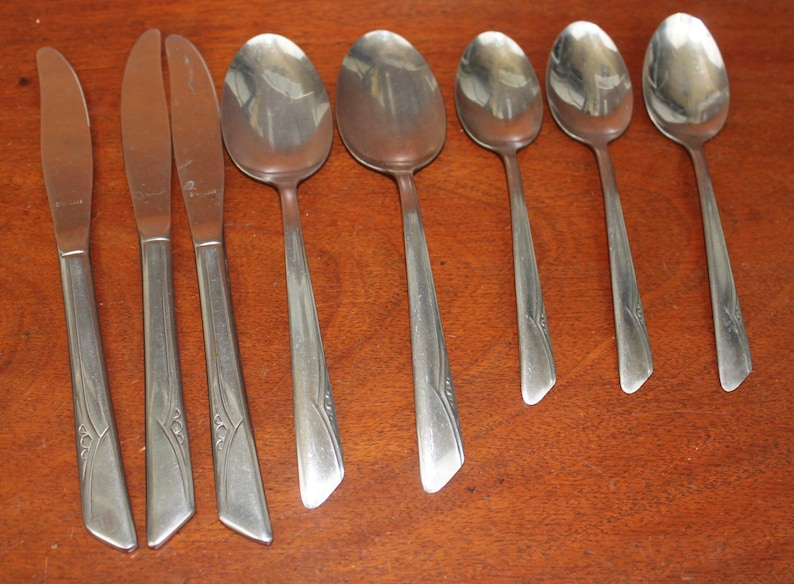
Identify the location of spoons. The width and height of the screenshot is (794, 584). (290, 221), (405, 205), (515, 194), (611, 185), (703, 179).